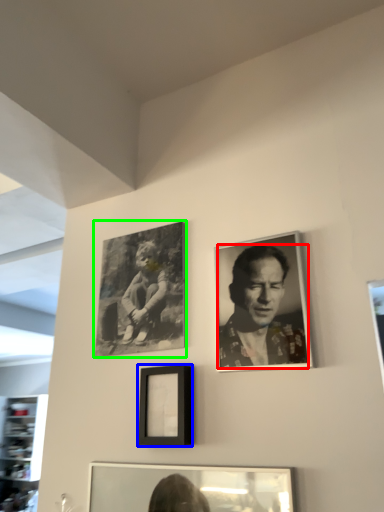
Question: Based on their relative distances, which object is nearer to man (highlighted by a red box)? Choose from picture frame (highlighted by a blue box) and picture frame (highlighted by a green box).

Choices:
 (A) picture frame
 (B) picture frame

Answer: (A)